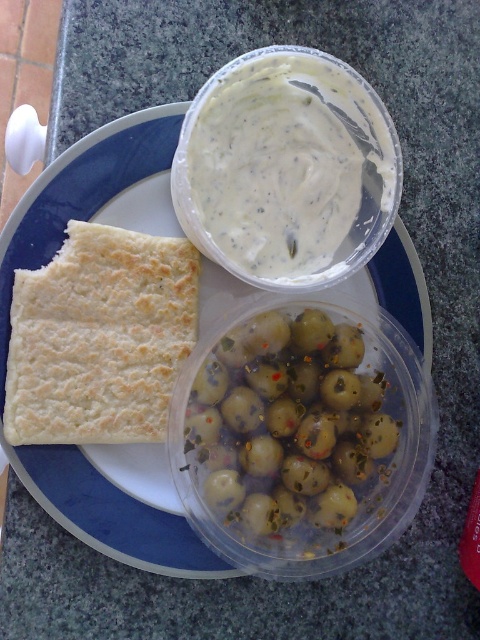
Question: Among these points, which one is nearest to the camera?

Choices:
 (A) (147, 422)
 (B) (193, 536)

Answer: (A)

Question: Can you confirm if white matte flatbread at left is positioned to the right of white crumbly flatbread at left?

Choices:
 (A) no
 (B) yes

Answer: (B)

Question: Which of these objects is positioned farthest from the white crumbly flatbread at left?

Choices:
 (A) white matte flatbread at left
 (B) green glossy olives at center

Answer: (B)

Question: Which point appears farthest from the camera in this image?

Choices:
 (A) (122, 348)
 (B) (164, 488)
 (C) (216, 371)

Answer: (B)

Question: Can you confirm if white matte flatbread at left is bigger than green glossy olives at center?

Choices:
 (A) no
 (B) yes

Answer: (B)

Question: Is green glossy olives at center positioned before white crumbly flatbread at left?

Choices:
 (A) no
 (B) yes

Answer: (A)